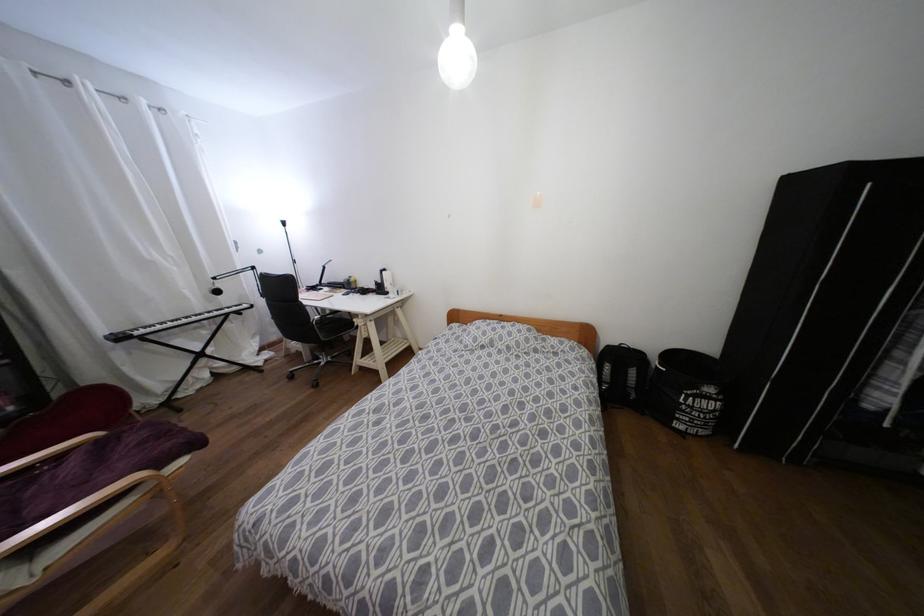
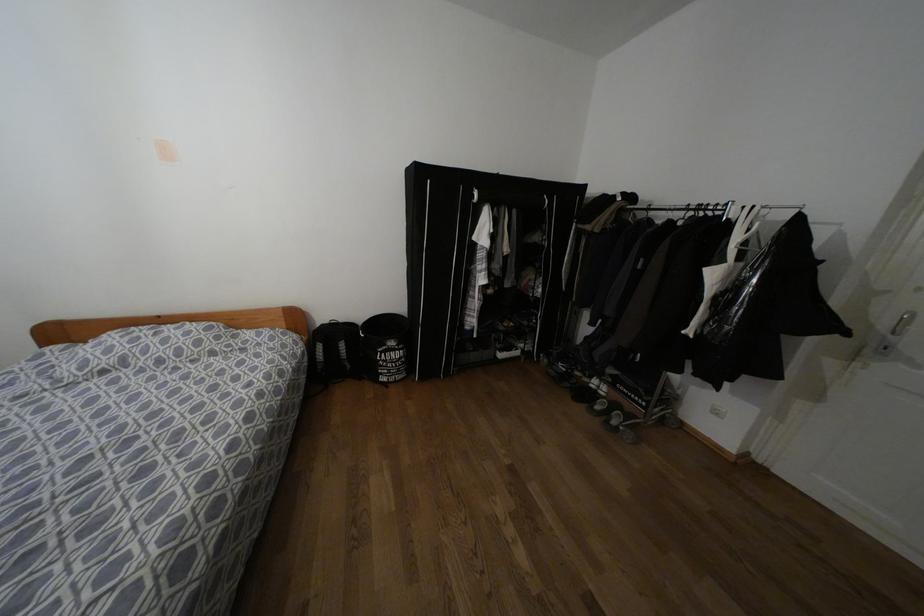
In the second image, find the point that corresponds to the point at 709,389 in the first image.

(391, 342)